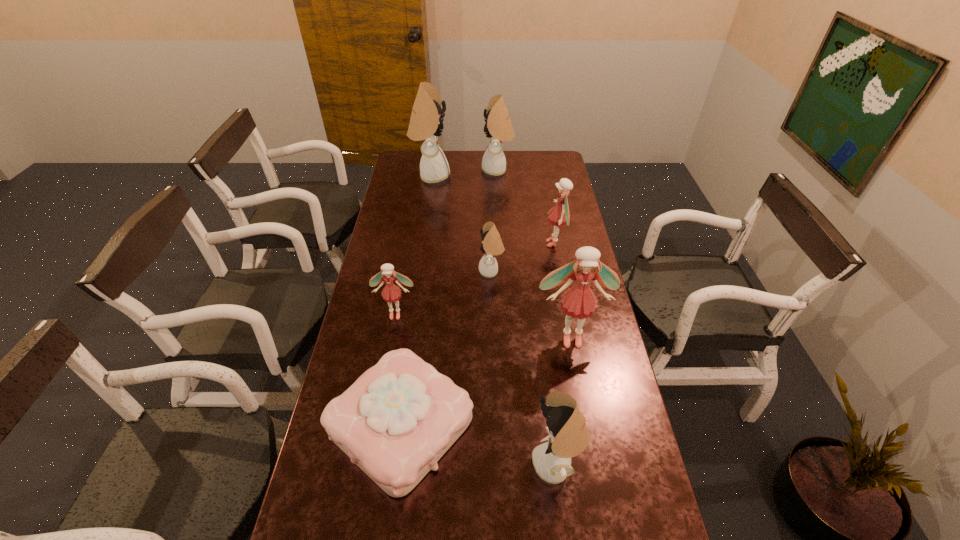
Find the location of a particular element. Image resolution: width=960 pixels, height=540 pixels. pink doll that is the second closest to the biggest black doll is located at coordinates (391, 293).

Identify the location of vacant region that satisfies the following two spatial constraints: 1. at the front face of the tallest doll; 2. on the left side of the pink cake. (394, 425).

What are the coordinates of `vacant space that satisfies the following two spatial constraints: 1. at the front face of the second nearest black doll; 2. on the front side of the pink cake` in the screenshot? It's located at (495, 425).

The image size is (960, 540). Find the location of `vacant point that satisfies the following two spatial constraints: 1. on the front-facing side of the biggest pink doll; 2. at the front face of the third biggest black doll`. vacant point that satisfies the following two spatial constraints: 1. on the front-facing side of the biggest pink doll; 2. at the front face of the third biggest black doll is located at coordinates (595, 464).